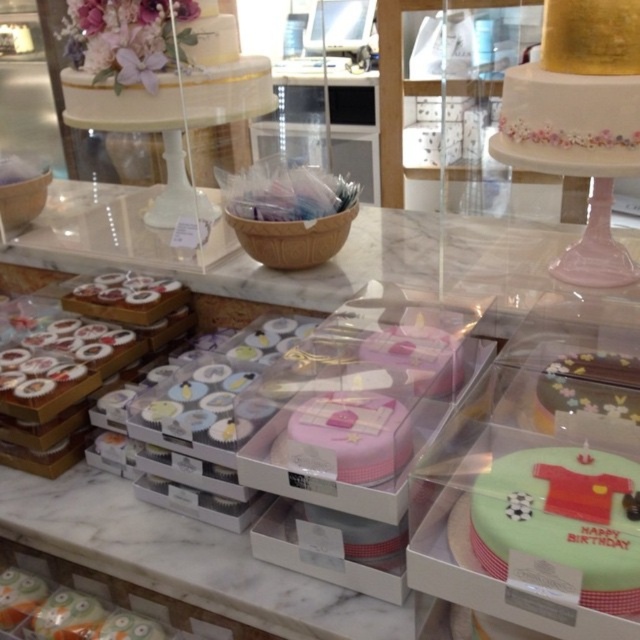
You are a customer at the bakery and want to take a photo of the gold metallic cake at upper right. The camera you are using has a minimum focus distance of 30 inches. Will you be able to focus on the cake without moving closer?

The gold metallic cake at upper right is 35.44 inches away from the camera, which is beyond the minimum focus distance of 30 inches. Therefore, you can focus on the cake without moving closer.

You are a customer at the bakery and want to place the pink matte cupcake at center and the green frosted cake at lower right on a rectangular tray. The tray has a width of 40 cm. If the combined width of both items is 38 cm, will they fit side by side on the tray?

The pink matte cupcake at center might be wider than green frosted cake at lower right, but their combined width is 38 cm, which is less than the tray width of 40 cm. Therefore, they should fit side by side on the tray.

You are a customer in the bakery and want to take a photo of both the point at (614, 148) and the point at (504, 476). Which point should you stand closer to in order to capture both in the same frame without moving the camera?

You should stand closer to point (504, 476) because point (614, 148) is behind it, so positioning yourself near the closer point allows both to be in the frame.